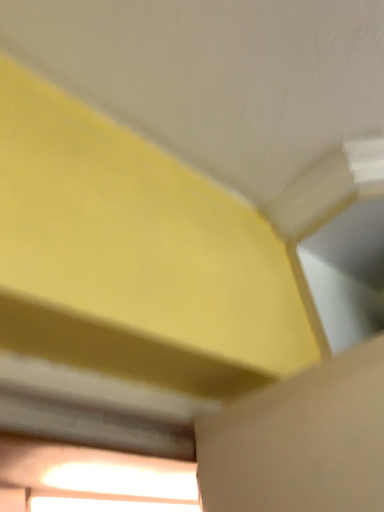
Describe the element at coordinates (104, 503) in the screenshot. I see `white glossy window at lower left` at that location.

Locate an element on the screen. The height and width of the screenshot is (512, 384). white glossy window at lower left is located at coordinates (104, 503).

In order to click on white glossy window at lower left in this screenshot , I will do tap(104, 503).